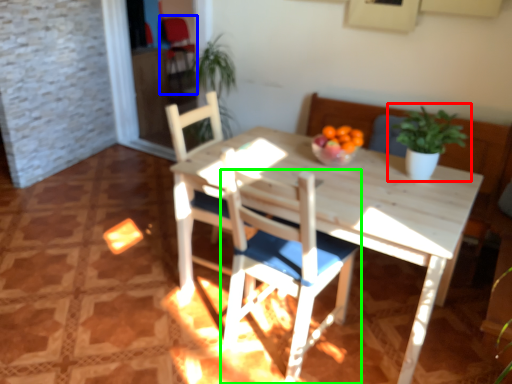
Question: Considering the real-world distances, which object is closest to houseplant (highlighted by a red box)? armchair (highlighted by a blue box) or chair (highlighted by a green box).

Choices:
 (A) armchair
 (B) chair

Answer: (B)